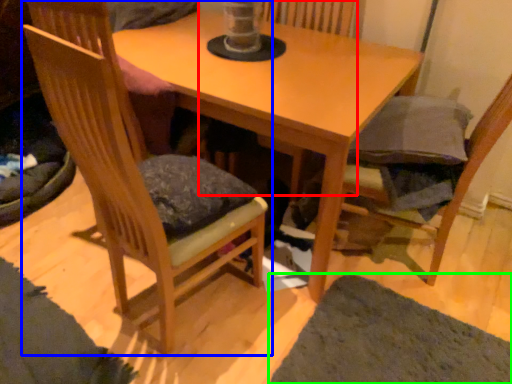
Question: Which object is positioned closest to swivel chair (highlighted by a red box)? Select from chair (highlighted by a blue box) and mat (highlighted by a green box).

Choices:
 (A) chair
 (B) mat

Answer: (A)